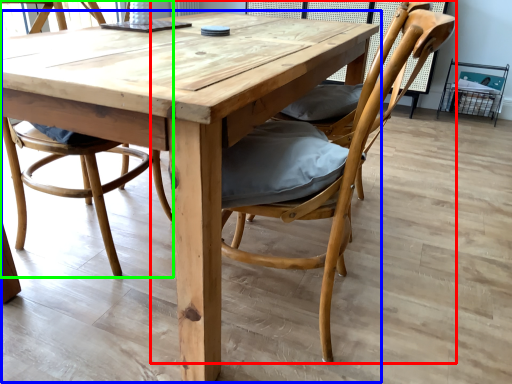
Question: Estimate the real-world distances between objects in this image. Which object is closer to chair (highlighted by a red box), kitchen & dining room table (highlighted by a blue box) or chair (highlighted by a green box)?

Choices:
 (A) kitchen & dining room table
 (B) chair

Answer: (A)